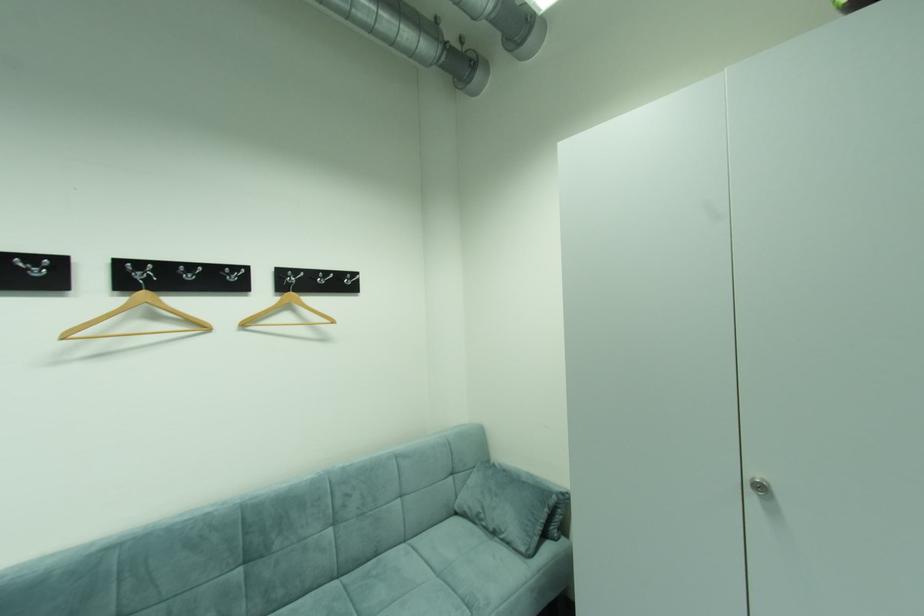
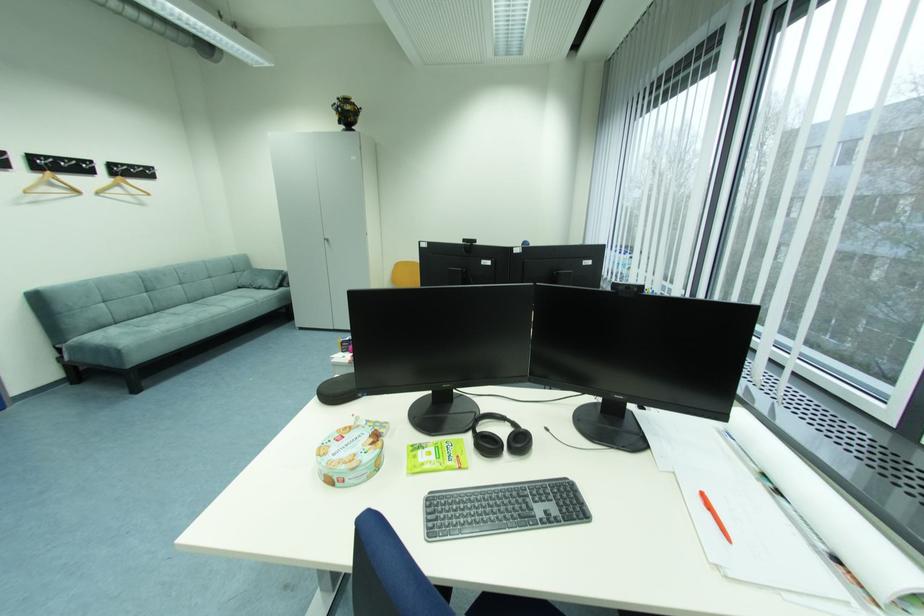
The point at (161, 318) is marked in the first image. Where is the corresponding point in the second image?

(59, 185)